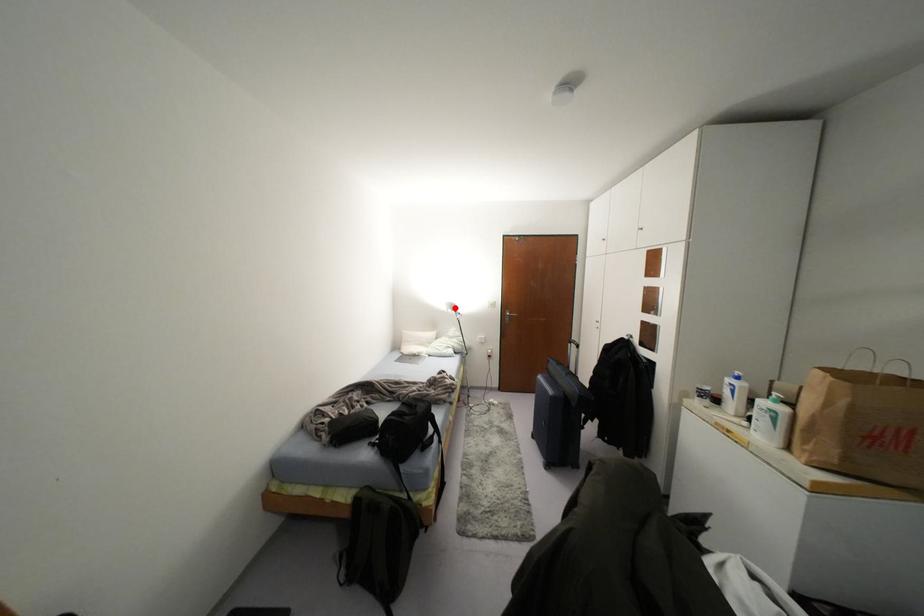
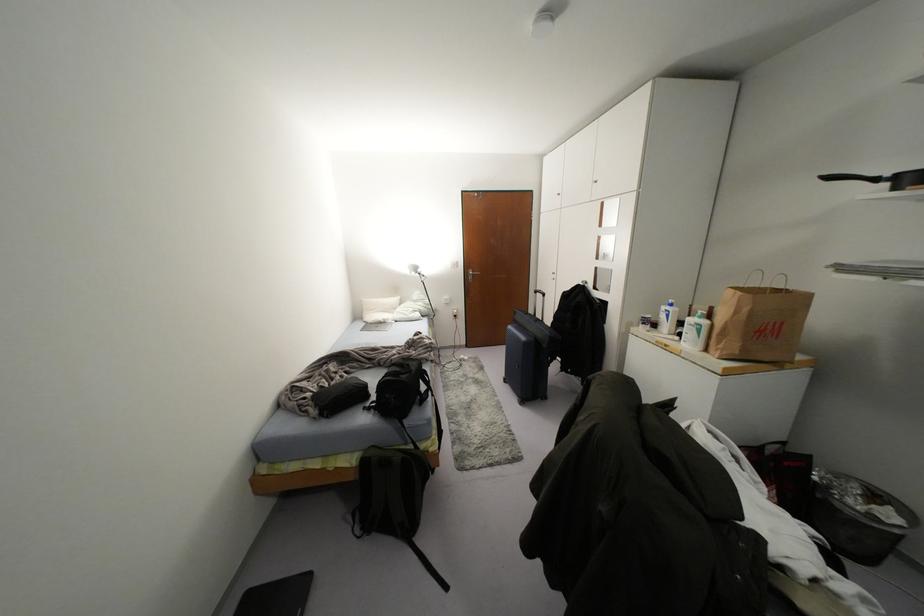
Where in the second image is the point corresponding to the highlighted location from the first image?

(419, 270)